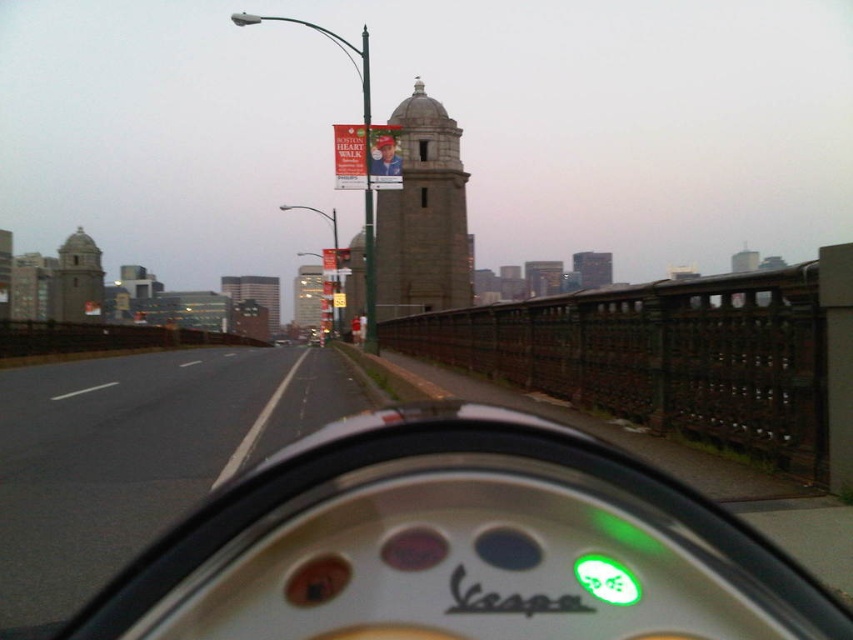
Is gray stone tower at center thinner than stone tower at center?

Correct, gray stone tower at center's width is less than stone tower at center's.

Consider the image. Measure the distance between gray stone tower at center and camera.

gray stone tower at center and camera are 23.72 meters apart.

This screenshot has width=853, height=640. What are the coordinates of `gray stone tower at center` in the screenshot? It's located at (422, 216).

Between white matte vespa at center and stone tower at center, which one appears on the left side from the viewer's perspective?

stone tower at center

Does white matte vespa at center have a greater height compared to stone tower at center?

No.

Is point (686, 589) less distant than point (312, 282)?

Yes, it is.

You are a GUI agent. You are given a task and a screenshot of the screen. Output one action in this format:
    pyautogui.click(x=<x>, y=<y>)
    Task: Click on the white matte vespa at center
    The height and width of the screenshot is (640, 853).
    Given the screenshot: What is the action you would take?
    pyautogui.click(x=459, y=545)

Does black asphalt highway at center have a lesser height compared to gray stone tower at center?

Indeed, black asphalt highway at center has a lesser height compared to gray stone tower at center.

Does black asphalt highway at center appear on the right side of gray stone tower at center?

In fact, black asphalt highway at center is to the left of gray stone tower at center.

Is point (241, 444) farther from camera compared to point (422, 225)?

No, (241, 444) is in front of (422, 225).

I want to click on black asphalt highway at center, so click(136, 454).